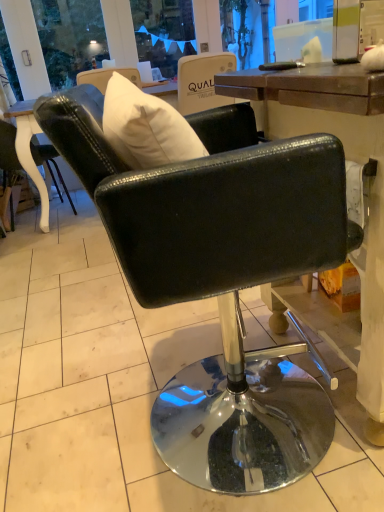
At what (x,y) coordinates should I click in order to perform the action: click on vacant region to the left of glossy black chair at center, the first chair positioned from the front. Please return your answer as a coordinate pair (x, y). The height and width of the screenshot is (512, 384). Looking at the image, I should click on (63, 413).